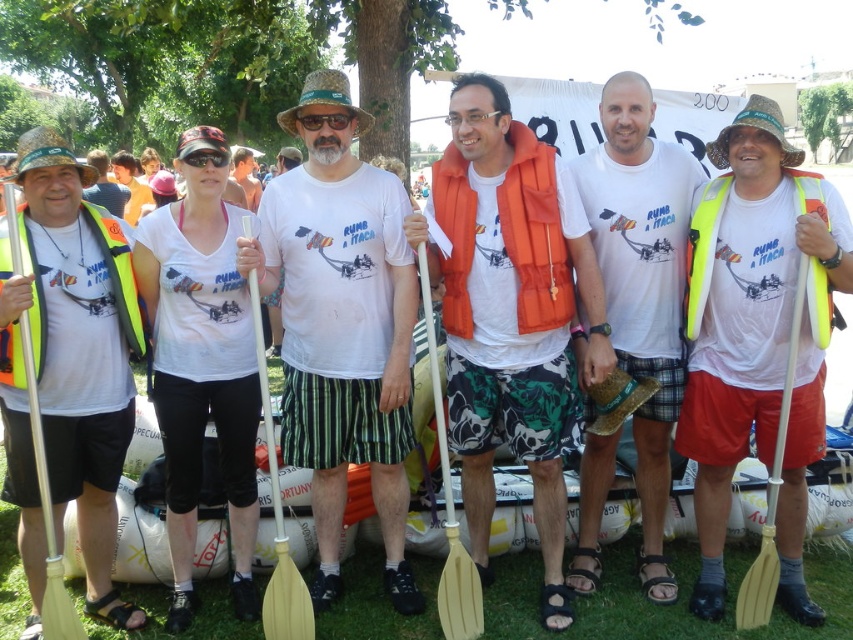
Between point (465, 634) and point (766, 593), which one is positioned behind?

The point (766, 593) is more distant.

Measure the distance from yellow wood paddle at center to yellow plastic paddle at center.

A distance of 6.80 feet exists between yellow wood paddle at center and yellow plastic paddle at center.

Is point (469, 589) closer to viewer compared to point (781, 406)?

No, it is not.

You are a GUI agent. You are given a task and a screenshot of the screen. Output one action in this format:
    pyautogui.click(x=<x>, y=<y>)
    Task: Click on the yellow wood paddle at center
    
    Given the screenshot: What is the action you would take?
    pyautogui.click(x=450, y=502)

Is matte yellow vest at left to the left of black plastic goggles at center from the viewer's perspective?

Indeed, matte yellow vest at left is positioned on the left side of black plastic goggles at center.

Identify the location of matte yellow vest at left. (105, 186).

Does yellow reflective vest at right have a greater width compared to yellow wood paddle at center?

In fact, yellow reflective vest at right might be narrower than yellow wood paddle at center.

Does yellow reflective vest at right have a smaller size compared to yellow wood paddle at center?

Indeed, yellow reflective vest at right has a smaller size compared to yellow wood paddle at center.

Does point (708, 198) come closer to viewer compared to point (451, 588)?

No, it is behind (451, 588).

Locate an element on the screen. This screenshot has width=853, height=640. yellow reflective vest at right is located at coordinates (x=703, y=250).